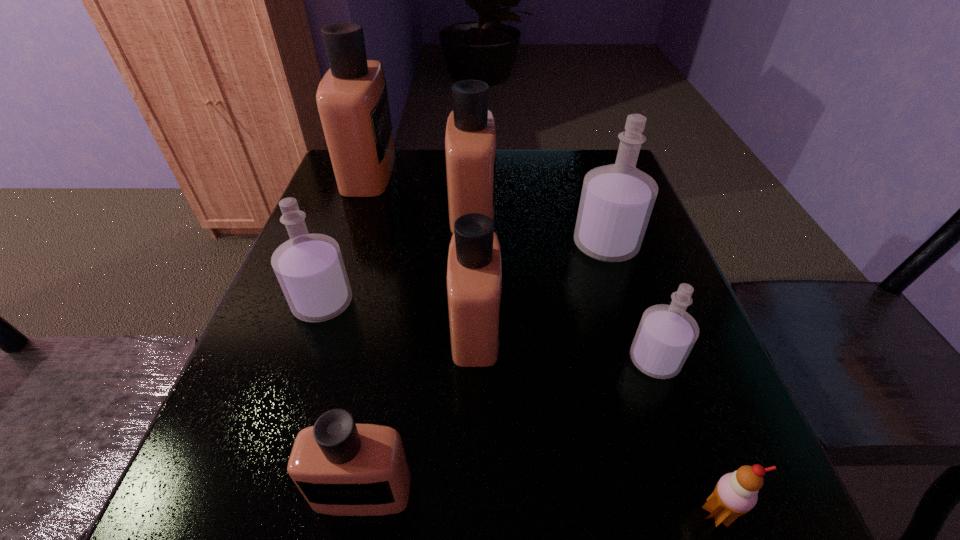
What are the coordinates of `purple perfume that is the third closest to the third smallest beige perfume` in the screenshot? It's located at (666, 334).

Locate an element on the screen. This screenshot has width=960, height=540. the second closest purple perfume to the third biggest beige perfume is located at coordinates (309, 267).

The image size is (960, 540). In order to click on vacant position in the image that satisfies the following two spatial constraints: 1. on the front label of the tallest object; 2. on the back side of the smallest purple perfume in this screenshot , I will do `click(304, 360)`.

Locate an element on the screen. vacant position in the image that satisfies the following two spatial constraints: 1. on the front label of the nearest purple perfume; 2. on the right side of the leftmost beige perfume is located at coordinates (304, 360).

The height and width of the screenshot is (540, 960). What are the coordinates of `vacant point that satisfies the following two spatial constraints: 1. on the front label of the biggest beige perfume; 2. on the left side of the smallest purple perfume` in the screenshot? It's located at (304, 360).

Identify the location of free space that satisfies the following two spatial constraints: 1. on the front label of the third smallest beige perfume; 2. on the right side of the biggest purple perfume. (471, 245).

Where is `vacant space that satisfies the following two spatial constraints: 1. on the front label of the third smallest beige perfume; 2. on the front label of the third beige perfume from right to left`? The width and height of the screenshot is (960, 540). vacant space that satisfies the following two spatial constraints: 1. on the front label of the third smallest beige perfume; 2. on the front label of the third beige perfume from right to left is located at coordinates (466, 491).